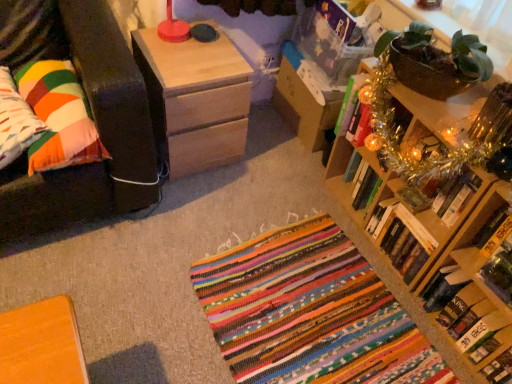
This screenshot has height=384, width=512. Identify the location of free space in front of hardcover book at center right, which is the third book in top-to-bottom order. (393, 301).